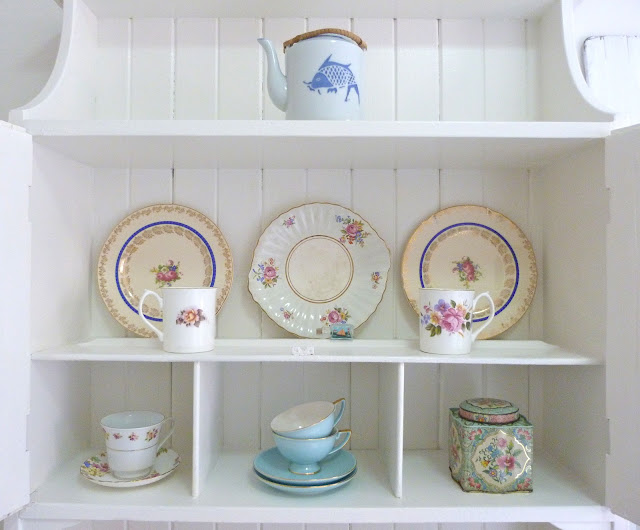
Identify the location of baby blue cups. (310, 452), (320, 431).